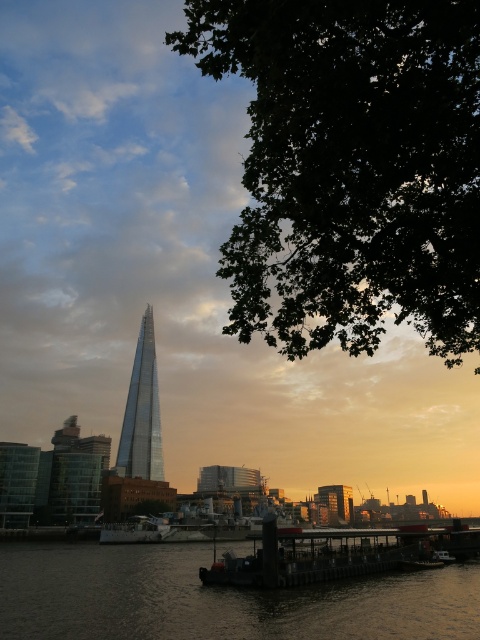
You are a photographer planning to capture the skyline of the city with both the metallic gray ship at center and the green leafy tree at center in your shot. Which object should you position closer to the edge of the frame to ensure both fit in the photo?

The metallic gray ship at center might be wider than the green leafy tree at center, so positioning the wider metallic gray ship at center closer to the edge of the frame would help ensure both fit in the photo.

Based on the scene described, which object is shorter between the green leafy tree at upper right and the glassy metallic tower at center?

The green leafy tree at upper right is shorter than the glassy metallic tower at center.